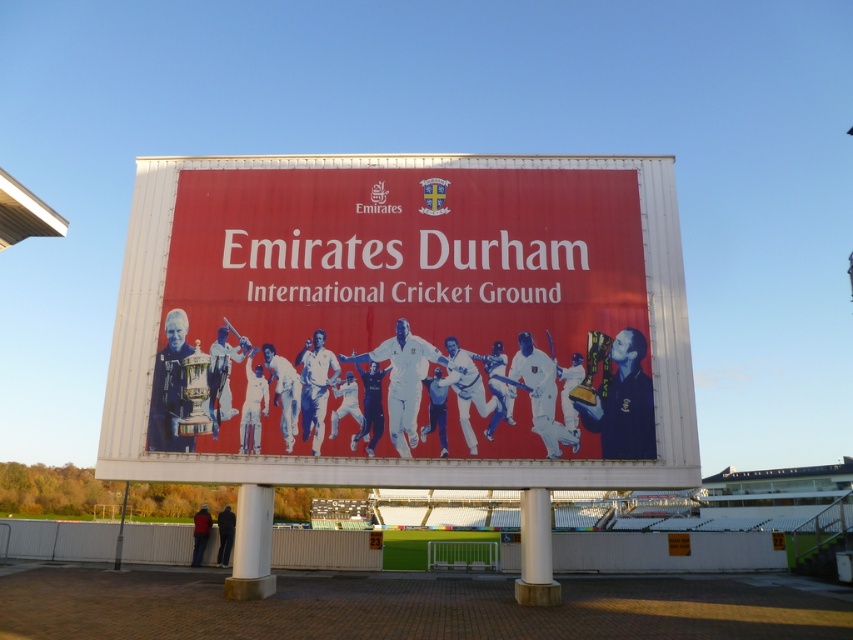
You are an architect inspecting the Emirates Durham International Cricket Ground. You notice two pillars supporting the advertisement board. Which pillar takes up more space? Please refer to the white concrete pillar at center and the white polished concrete pillar at center in your answer.

The white polished concrete pillar at center takes up more space than the white concrete pillar at center because the white concrete pillar at center occupies less space than the white polished concrete pillar at center.

Based on the photo, you are an event organizer planning to place a decorative banner between the matte red poster at center and the white polished concrete pillar at center. Given that the banner must be narrower than both objects to fit, can you confirm if this is possible?

The matte red poster at center is wider than the white polished concrete pillar at center. Since the banner must be narrower than both, the maximum width allowed would be based on the narrower object, which is the white polished concrete pillar at center. Therefore, the banner must be narrower than the white polished concrete pillar at center to fit between them.

You are an architect inspecting the Emirates Durham International Cricket Ground. You notice two pillars supporting the advertisement board. The pillars are labeled as the white concrete pillar at center and the white polished concrete pillar at center. Which pillar is located above the other?

The white concrete pillar at center is positioned over the white polished concrete pillar at center, meaning the white concrete pillar at center is above the white polished concrete pillar at center.